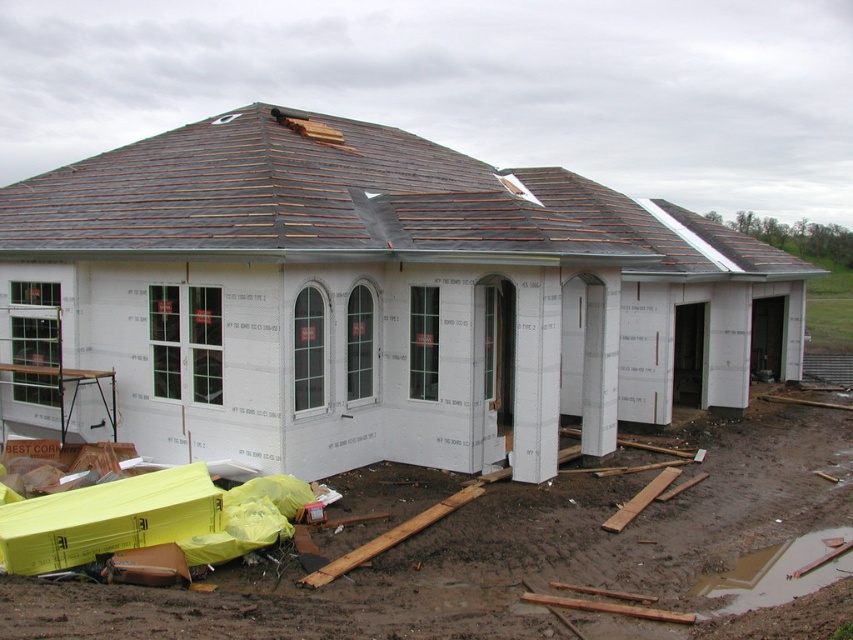
You are standing at the entrance of the house under construction. You need to place a new wooden plank exactly at the point marked by the coordinates point (380, 298). However, there is an object already present at that location. What is the object blocking your way?

The white foam insulation at center is located at point (380, 298), so the object blocking your way is the white foam insulation at center.

You are a contractor assessing the construction site. You notice the white foam insulation at center and the shiny brown shingles at upper center. Which of these two items is positioned higher up in the structure?

The white foam insulation at center is taller than the shiny brown shingles at upper center, so the white foam insulation at center is positioned higher up in the structure.